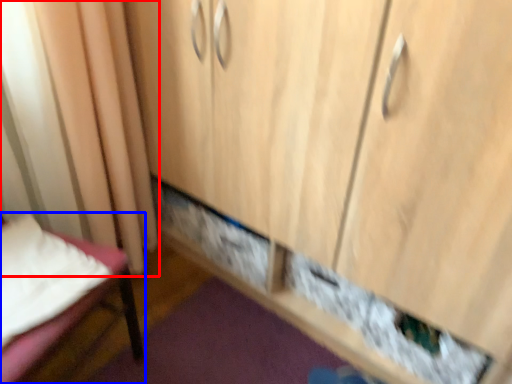
Question: Which object is further to the camera taking this photo, curtain (highlighted by a red box) or furniture (highlighted by a blue box)?

Choices:
 (A) curtain
 (B) furniture

Answer: (A)